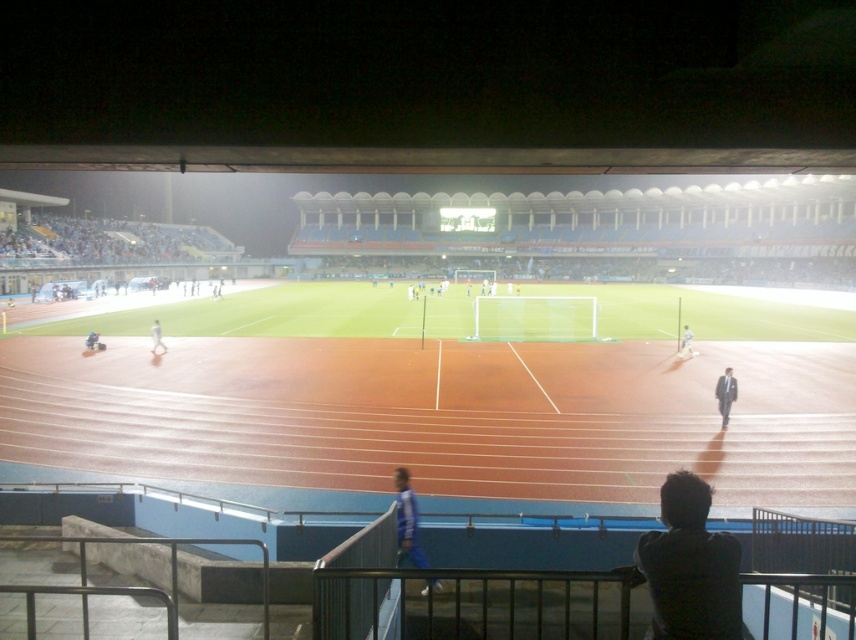
From the picture: Is blue fabric pants at lower center to the left of white matte person at center from the viewer's perspective?

In fact, blue fabric pants at lower center is to the right of white matte person at center.

Between point (409, 561) and point (159, 330), which one is positioned in front?

Point (409, 561)

Where is `blue fabric pants at lower center`? The width and height of the screenshot is (856, 640). blue fabric pants at lower center is located at coordinates (407, 524).

The width and height of the screenshot is (856, 640). Identify the location of blue fabric pants at lower center. (x=407, y=524).

Which is in front, point (724, 628) or point (159, 348)?

Positioned in front is point (724, 628).

Image resolution: width=856 pixels, height=640 pixels. I want to click on dark blue shirt at lower right, so click(690, 566).

Is blue fabric pants at lower center to the right of light blue fabric shirt at right from the viewer's perspective?

Incorrect, blue fabric pants at lower center is not on the right side of light blue fabric shirt at right.

Who is more distant from viewer, (440, 586) or (685, 344)?

The point (685, 344) is behind.

The height and width of the screenshot is (640, 856). What are the coordinates of `blue fabric pants at lower center` in the screenshot? It's located at (407, 524).